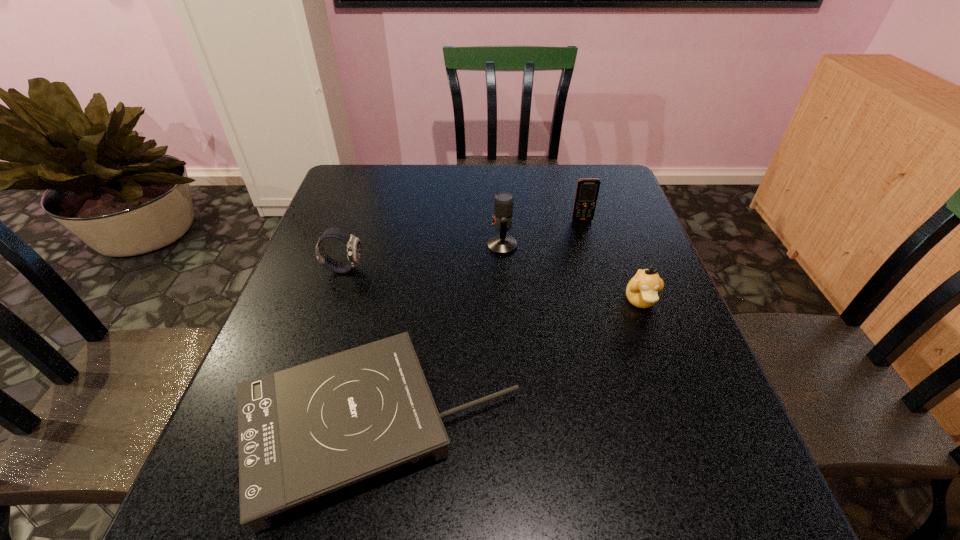
Find the location of a particular element. object at the near left corner is located at coordinates (303, 432).

Identify the location of free spot at the far edge of the desktop. The height and width of the screenshot is (540, 960). (420, 192).

Identify the location of free space at the left edge. The image size is (960, 540). (292, 331).

The width and height of the screenshot is (960, 540). I want to click on vacant space at the right edge, so (624, 320).

The width and height of the screenshot is (960, 540). In the image, there is a desktop. Identify the location of free space at the far right corner. tap(614, 173).

Where is `free space between the fourth farthest object and the farthest object`? The width and height of the screenshot is (960, 540). free space between the fourth farthest object and the farthest object is located at coordinates (612, 260).

The height and width of the screenshot is (540, 960). Find the location of `unoccupied position between the nearest object and the second nearest object`. unoccupied position between the nearest object and the second nearest object is located at coordinates (509, 364).

Locate an element on the screen. The image size is (960, 540). blank region between the nearest object and the second nearest object is located at coordinates (509, 364).

Where is `vacant point located between the duckling and the shortest object`? The width and height of the screenshot is (960, 540). vacant point located between the duckling and the shortest object is located at coordinates [x=509, y=364].

This screenshot has width=960, height=540. Identify the location of unoccupied area between the shortest object and the microphone. (440, 336).